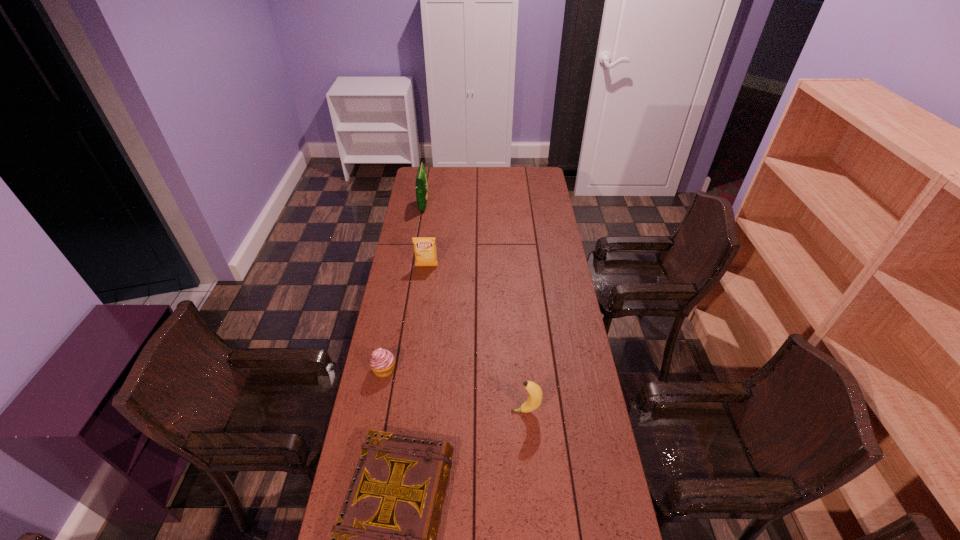
Where is `the farther crisp (potato chip)`? This screenshot has width=960, height=540. the farther crisp (potato chip) is located at coordinates (421, 187).

The width and height of the screenshot is (960, 540). Find the location of `the taller crisp (potato chip)`. the taller crisp (potato chip) is located at coordinates (421, 187).

You are a GUI agent. You are given a task and a screenshot of the screen. Output one action in this format:
    pyautogui.click(x=<x>, y=<y>)
    Task: Click on the second nearest object
    The width and height of the screenshot is (960, 540).
    Given the screenshot: What is the action you would take?
    pyautogui.click(x=534, y=400)

At what (x,y) coordinates should I click in order to perform the action: click on the rightmost object. Please return your answer as a coordinate pair (x, y). The height and width of the screenshot is (540, 960). Looking at the image, I should click on (534, 400).

The height and width of the screenshot is (540, 960). Find the location of `the fourth nearest object`. the fourth nearest object is located at coordinates (424, 247).

At what (x,y) coordinates should I click in order to perform the action: click on the nearer crisp (potato chip). Please return your answer as a coordinate pair (x, y). The width and height of the screenshot is (960, 540). Looking at the image, I should click on (424, 247).

This screenshot has width=960, height=540. I want to click on cupcake, so click(382, 362).

Locate an element on the screen. The image size is (960, 540). the second shortest object is located at coordinates (382, 362).

Locate an element on the screen. free space located on the front-facing side of the taller crisp (potato chip) is located at coordinates (463, 206).

The height and width of the screenshot is (540, 960). In order to click on vacant space located 0.310m from the stem of the second nearest object in this screenshot , I will do `click(420, 411)`.